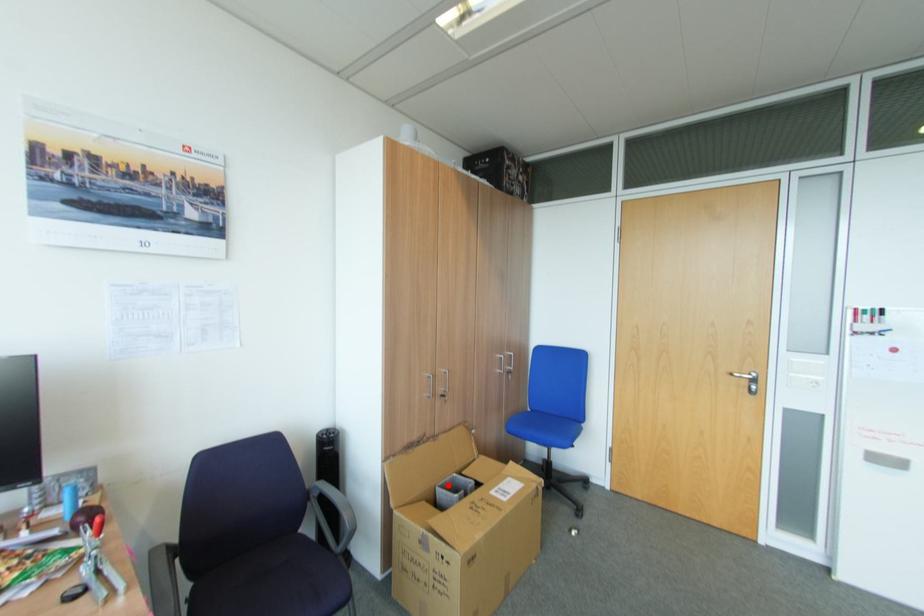
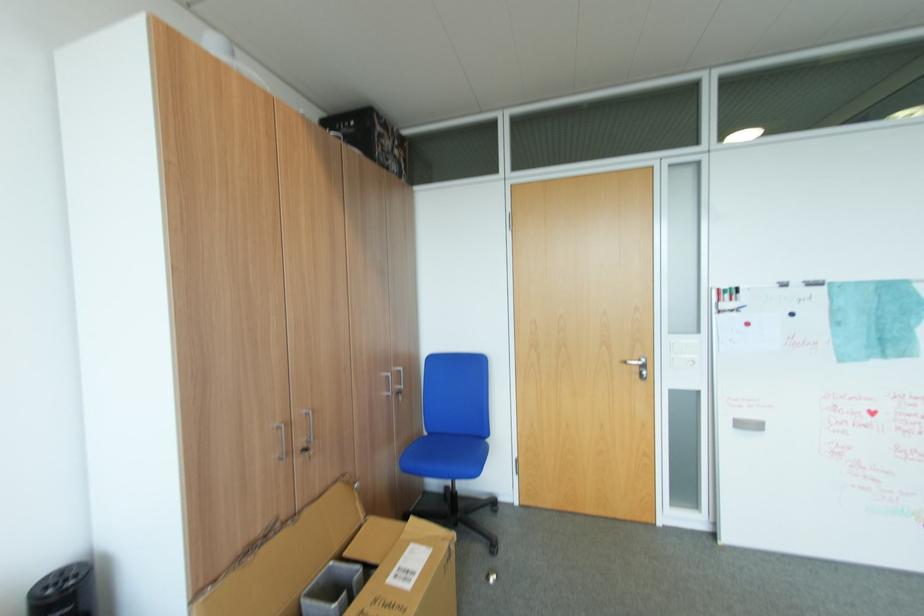
Where in the second image is the point corresponding to the highlighted location from the first image?

(317, 593)